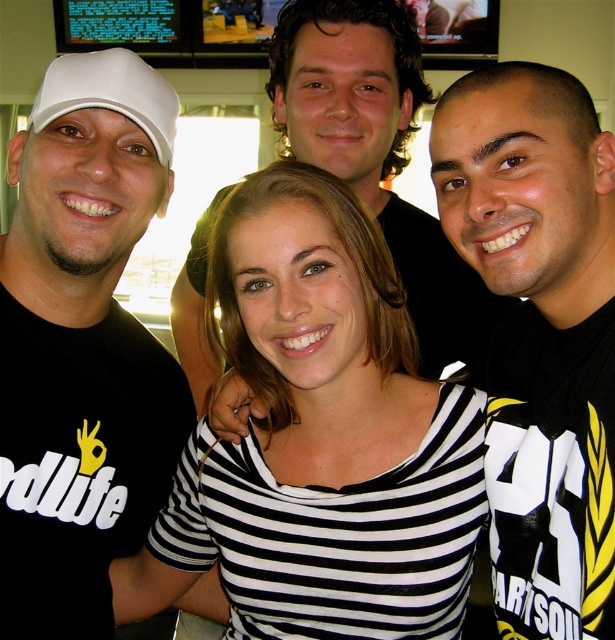
Question: Observing the image, what is the correct spatial positioning of black matte t-shirt at left in reference to black and white striped shirt at center?

Choices:
 (A) left
 (B) right

Answer: (A)

Question: Which object is farther from the camera taking this photo?

Choices:
 (A) black matte t-shirt at left
 (B) black and white striped shirt at center
 (C) white matte baseball cap at left
 (D) matte black shirt at center

Answer: (D)

Question: Is black and white striped shirt at center wider than matte black shirt at center?

Choices:
 (A) yes
 (B) no

Answer: (B)

Question: Which object appears farthest from the camera in this image?

Choices:
 (A) black and white striped shirt at center
 (B) white matte baseball cap at left
 (C) black matte t-shirt at left
 (D) matte black shirt at center

Answer: (D)

Question: Is black matte t-shirt at left smaller than white matte baseball cap at left?

Choices:
 (A) no
 (B) yes

Answer: (A)

Question: Which object is farther from the camera taking this photo?

Choices:
 (A) white matte baseball cap at left
 (B) matte black shirt at center
 (C) black matte t-shirt at left
 (D) black and white striped shirt at center

Answer: (B)